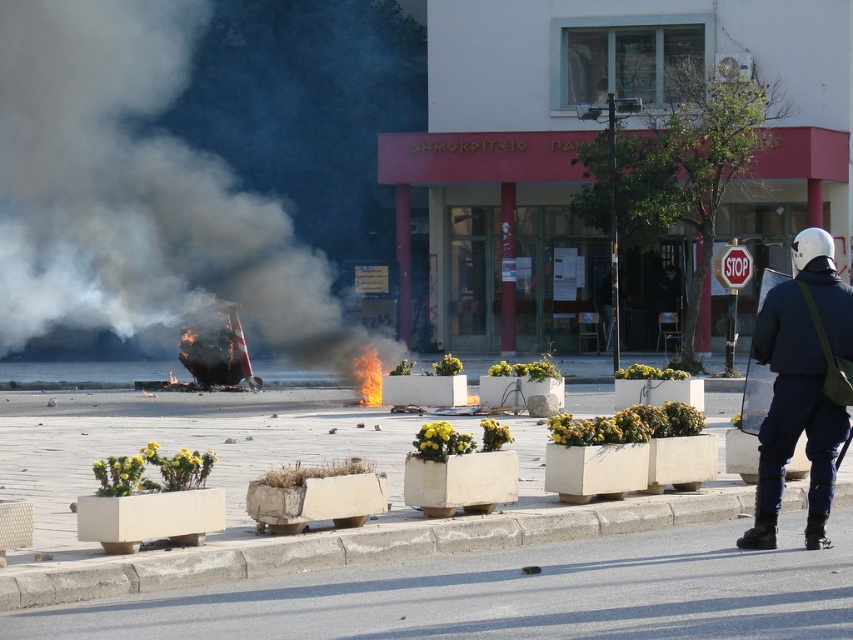
Does black smoke at left come behind dark blue uniform at right?

No, black smoke at left is in front of dark blue uniform at right.

Between black smoke at left and dark blue uniform at right, which one is positioned higher?

black smoke at left

Is point (329, 260) behind point (781, 349)?

That is True.

What are the coordinates of `black smoke at left` in the screenshot? It's located at (198, 161).

Between point (310, 4) and point (126, 582), which one is positioned behind?

The point (310, 4) is more distant.

Is black smoke at left shorter than concrete at lower center?

In fact, black smoke at left may be taller than concrete at lower center.

What do you see at coordinates (198, 161) in the screenshot? I see `black smoke at left` at bounding box center [198, 161].

This screenshot has width=853, height=640. In order to click on black smoke at left in this screenshot , I will do `click(198, 161)`.

The width and height of the screenshot is (853, 640). What do you see at coordinates (354, 547) in the screenshot?
I see `concrete at lower center` at bounding box center [354, 547].

This screenshot has height=640, width=853. What do you see at coordinates (354, 547) in the screenshot?
I see `concrete at lower center` at bounding box center [354, 547].

Find the location of `concrete at lower center`. concrete at lower center is located at coordinates (354, 547).